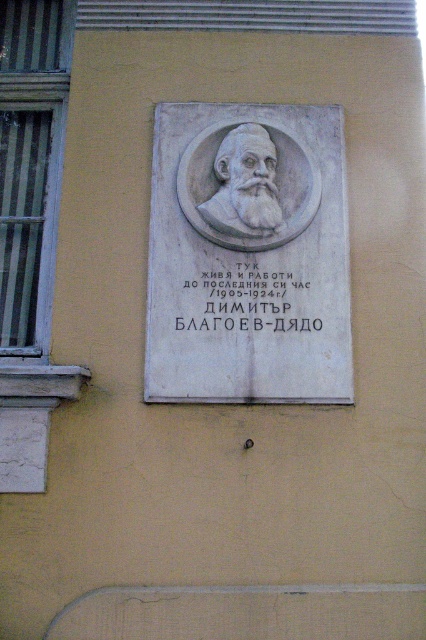
Question: Which of these objects is positioned farthest from the white stone bust at center?

Choices:
 (A) black stone plaque at center
 (B) white stone relief at center

Answer: (A)

Question: Can you confirm if white stone bust at center is positioned below white marble bust at center?

Choices:
 (A) yes
 (B) no

Answer: (A)

Question: Which point appears closest to the camera in this image?

Choices:
 (A) (261, 136)
 (B) (218, 310)
 (C) (282, 218)

Answer: (B)

Question: Which is nearer to the white marble bust at center?

Choices:
 (A) white stone bust at center
 (B) white stone relief at center
 (C) black stone plaque at center

Answer: (A)

Question: Is white stone relief at center to the right of white marble bust at center from the viewer's perspective?

Choices:
 (A) no
 (B) yes

Answer: (B)

Question: From the image, what is the correct spatial relationship of white stone bust at center in relation to black stone plaque at center?

Choices:
 (A) left
 (B) right

Answer: (A)